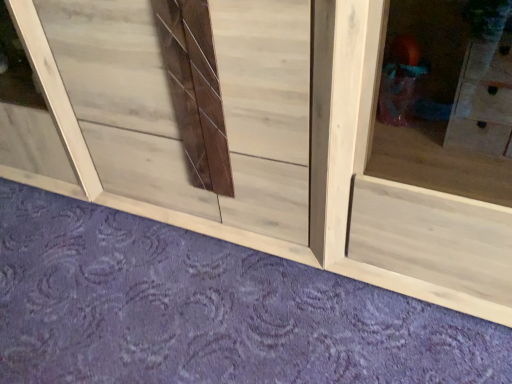
What do you see at coordinates (207, 310) in the screenshot? I see `natural wood cabinet at lower center` at bounding box center [207, 310].

Measure the distance between point (296, 279) and camera.

A distance of 4.15 feet exists between point (296, 279) and camera.

What is the approximate width of natural wood cabinet at lower center?

natural wood cabinet at lower center is 1.96 meters wide.

The width and height of the screenshot is (512, 384). What are the coordinates of `natural wood cabinet at lower center` in the screenshot? It's located at (207, 310).

This screenshot has height=384, width=512. I want to click on natural wood window frame at lower left, so [x=55, y=93].

The image size is (512, 384). What do you see at coordinates (55, 93) in the screenshot?
I see `natural wood window frame at lower left` at bounding box center [55, 93].

Find the location of a particular element. This screenshot has width=512, height=384. natural wood cabinet at lower center is located at coordinates (207, 310).

Considering the relative positions of natural wood window frame at lower left and natural wood cabinet at lower center in the image provided, is natural wood window frame at lower left to the right of natural wood cabinet at lower center from the viewer's perspective?

Incorrect, natural wood window frame at lower left is not on the right side of natural wood cabinet at lower center.

From the picture: Which is behind, natural wood window frame at lower left or natural wood cabinet at lower center?

Positioned behind is natural wood window frame at lower left.

Does point (97, 183) appear closer or farther from the camera than point (263, 297)?

Point (97, 183) is farther from the camera than point (263, 297).

From the image's perspective, is natural wood window frame at lower left on natural wood cabinet at lower center?

Yes.

From a real-world perspective, which is physically above, natural wood window frame at lower left or natural wood cabinet at lower center?

natural wood window frame at lower left, from a real-world perspective.

Considering the sizes of natural wood window frame at lower left and natural wood cabinet at lower center in the image, is natural wood window frame at lower left wider or thinner than natural wood cabinet at lower center?

In the image, natural wood window frame at lower left appears to be more narrow than natural wood cabinet at lower center.

Does natural wood window frame at lower left have a greater height compared to natural wood cabinet at lower center?

Yes, natural wood window frame at lower left is taller than natural wood cabinet at lower center.

Is natural wood window frame at lower left bigger than natural wood cabinet at lower center?

Yes.

Is natural wood window frame at lower left completely or partially outside of natural wood cabinet at lower center?

natural wood window frame at lower left lies outside natural wood cabinet at lower center's area.

Is natural wood window frame at lower left directly adjacent to natural wood cabinet at lower center?

No.

Is natural wood window frame at lower left turned away from natural wood cabinet at lower center?

natural wood window frame at lower left does not have its back to natural wood cabinet at lower center.

What's the angular difference between natural wood window frame at lower left and natural wood cabinet at lower center's facing directions?

natural wood window frame at lower left and natural wood cabinet at lower center are facing 90.2 degrees away from each other.

Measure the distance between natural wood window frame at lower left and natural wood cabinet at lower center.

The distance of natural wood window frame at lower left from natural wood cabinet at lower center is 24.76 inches.

Find the location of a particular element. This screenshot has width=512, height=384. plain in front of the natural wood window frame at lower left is located at coordinates (207, 310).

Considering the positions of objects natural wood cabinet at lower center and natural wood window frame at lower left in the image provided, who is more to the left, natural wood cabinet at lower center or natural wood window frame at lower left?

natural wood window frame at lower left.

Is the depth of natural wood cabinet at lower center less than that of natural wood window frame at lower left?

Yes, natural wood cabinet at lower center is in front of natural wood window frame at lower left.

Does point (439, 379) come closer to viewer compared to point (86, 147)?

Yes, point (439, 379) is closer to viewer.

From the image's perspective, relative to natural wood window frame at lower left, is natural wood cabinet at lower center above or below?

natural wood cabinet at lower center is below natural wood window frame at lower left.

From a real-world perspective, who is located higher, natural wood cabinet at lower center or natural wood window frame at lower left?

natural wood window frame at lower left is physically above.

In the scene shown: Looking at their sizes, would you say natural wood cabinet at lower center is wider or thinner than natural wood window frame at lower left?

natural wood cabinet at lower center is wider than natural wood window frame at lower left.

Considering the sizes of objects natural wood cabinet at lower center and natural wood window frame at lower left in the image provided, who is shorter, natural wood cabinet at lower center or natural wood window frame at lower left?

natural wood cabinet at lower center.

Considering the relative sizes of natural wood cabinet at lower center and natural wood window frame at lower left in the image provided, is natural wood cabinet at lower center smaller than natural wood window frame at lower left?

Yes, natural wood cabinet at lower center is smaller than natural wood window frame at lower left.

Does natural wood cabinet at lower center contain natural wood window frame at lower left?

No, natural wood window frame at lower left is not inside natural wood cabinet at lower center.

Are natural wood cabinet at lower center and natural wood window frame at lower left beside each other?

natural wood cabinet at lower center is not next to natural wood window frame at lower left, and they're not touching.

Could you tell me if natural wood cabinet at lower center is turned towards natural wood window frame at lower left?

No.

Based on the photo, can you tell me how much natural wood cabinet at lower center and natural wood window frame at lower left differ in facing direction?

There is a 90.2-degree angle between the facing directions of natural wood cabinet at lower center and natural wood window frame at lower left.

This screenshot has width=512, height=384. What are the coordinates of `plain to the right of natural wood window frame at lower left` in the screenshot? It's located at (207, 310).

You are a GUI agent. You are given a task and a screenshot of the screen. Output one action in this format:
    pyautogui.click(x=<x>, y=<y>)
    Task: Click on the window frame that appears above the natural wood cabinet at lower center (from the image's perspective)
    Image resolution: width=512 pixels, height=384 pixels.
    Given the screenshot: What is the action you would take?
    pos(55,93)

At what (x,y) coordinates should I click in order to perform the action: click on plain below the natural wood window frame at lower left (from the image's perspective). Please return your answer as a coordinate pair (x, y). The image size is (512, 384). Looking at the image, I should click on (207, 310).